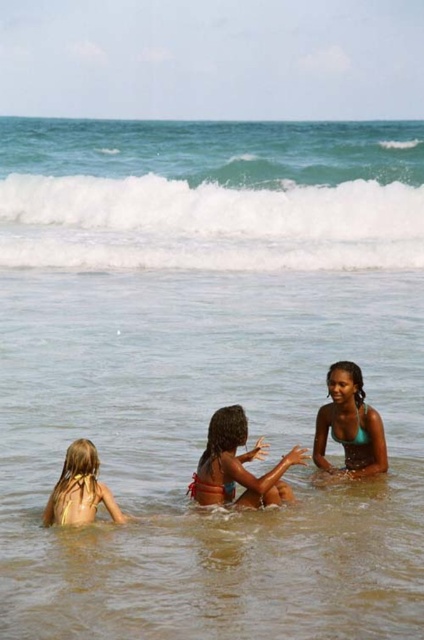
Question: Can you confirm if red bikini at center is bigger than yellow fabric swimsuit at lower left?

Choices:
 (A) yes
 (B) no

Answer: (A)

Question: Among these points, which one is nearest to the camera?

Choices:
 (A) (351, 401)
 (B) (67, 472)

Answer: (B)

Question: Among these objects, which one is nearest to the camera?

Choices:
 (A) red bikini at center
 (B) teal bikini at center
 (C) yellow fabric swimsuit at lower left

Answer: (C)

Question: Is teal bikini at center above yellow fabric swimsuit at lower left?

Choices:
 (A) yes
 (B) no

Answer: (A)

Question: Is teal bikini at center to the left of yellow fabric swimsuit at lower left from the viewer's perspective?

Choices:
 (A) no
 (B) yes

Answer: (A)

Question: Which object is the farthest from the red bikini at center?

Choices:
 (A) teal bikini at center
 (B) yellow fabric swimsuit at lower left

Answer: (A)